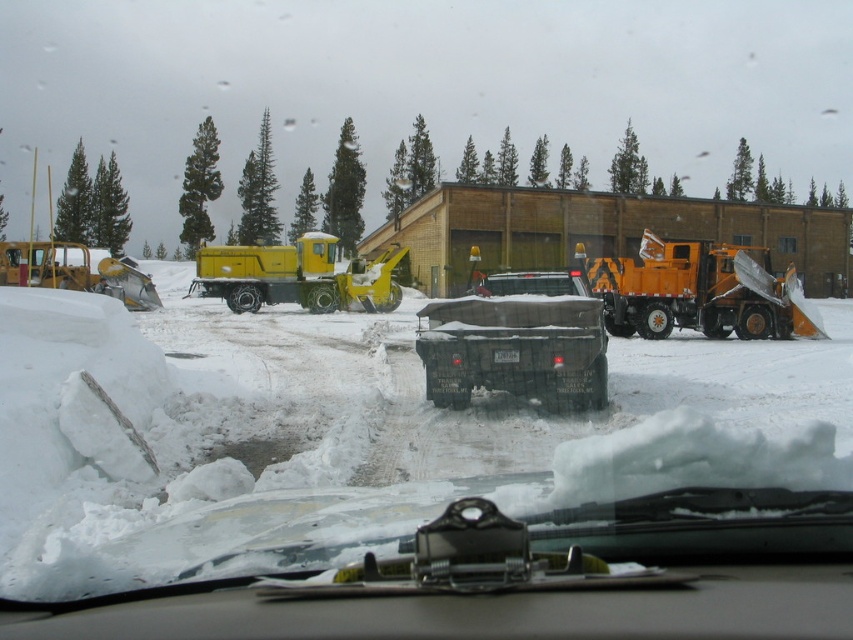
You are driving a car and want to exit the parking lot. You see an orange metallic snowplow at right and a yellow rubber snowplow at left. Which snowplow is closer to your car?

The orange metallic snowplow at right is closer to your car because it is in front of the yellow rubber snowplow at left.

In the scene shown: You are driving a car and want to park your vehicle between the yellow matte truck at center and the yellow rubber snowplow at left. Is there enough space between them to fit your car?

The yellow matte truck at center is to the right of the yellow rubber snowplow at left, so there is space between them. However, the exact width of the space isn

You are inside a vehicle and looking through the windshield. You see a yellow matte truck at center. Where is the yellow matte truck at center located in relation to the point marked at coordinates (297, 276)?

The yellow matte truck at center is represented by the point marked at coordinates (297, 276).